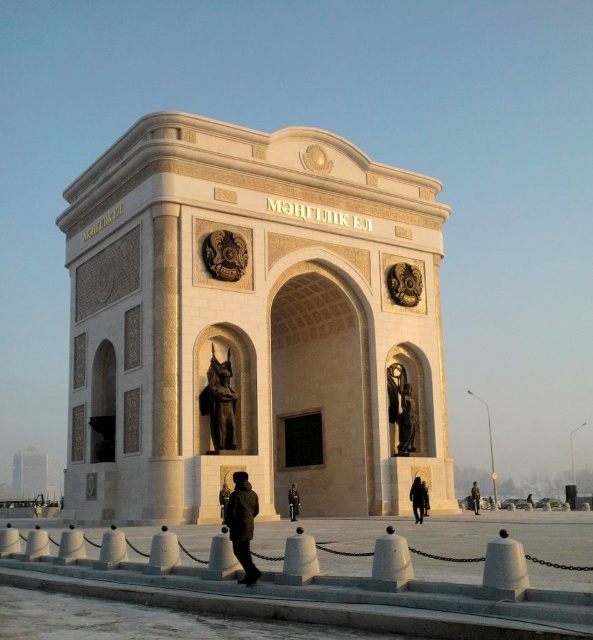
Question: Is satin gold statue at center smaller than black matte person at center?

Choices:
 (A) no
 (B) yes

Answer: (B)

Question: Which is farther from the black uniform at center?

Choices:
 (A) matte bronze statue at center
 (B) dark gray stone statue at center
 (C) satin gold statue at center
 (D) dark brown leather jacket at center

Answer: (B)

Question: Which is farther from the satin gold statue at center?

Choices:
 (A) black matte person at center
 (B) dark brown leather jacket at center
 (C) dark gray stone statue at center
 (D) matte bronze statue at center

Answer: (C)

Question: Is satin gold statue at center bigger than black matte person at center?

Choices:
 (A) no
 (B) yes

Answer: (A)

Question: Is satin gold statue at center to the left of dark gray stone statue at center from the viewer's perspective?

Choices:
 (A) no
 (B) yes

Answer: (B)

Question: Which point is farther to the camera?

Choices:
 (A) dark brown leather jacket at center
 (B) matte bronze statue at center

Answer: (B)